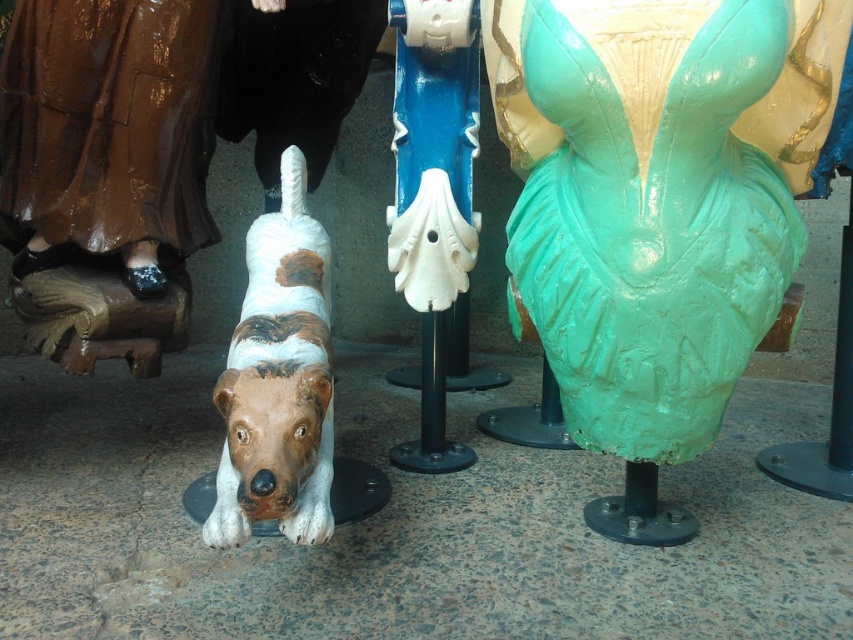
Does point (328, 432) lie in front of point (418, 172)?

That is True.

Is speckled ceramic dog at lower left wider than white glossy pole at center?

Yes.

At what (x,y) coordinates should I click in order to perform the action: click on speckled ceramic dog at lower left. Please return your answer as a coordinate pair (x, y). Looking at the image, I should click on (277, 380).